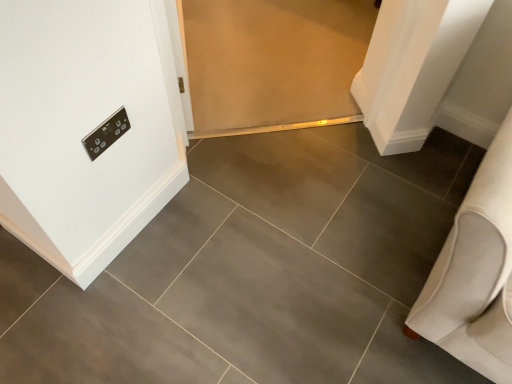
The height and width of the screenshot is (384, 512). What do you see at coordinates (475, 272) in the screenshot?
I see `white fabric sofa at right` at bounding box center [475, 272].

I want to click on white fabric sofa at right, so click(x=475, y=272).

Where is `satin silver switch at upper left`? satin silver switch at upper left is located at coordinates (106, 133).

The height and width of the screenshot is (384, 512). What do you see at coordinates (106, 133) in the screenshot? I see `satin silver switch at upper left` at bounding box center [106, 133].

Locate an element on the screen. The image size is (512, 384). white fabric sofa at right is located at coordinates (475, 272).

Visually, is satin silver switch at upper left positioned to the left or to the right of white fabric sofa at right?

In the image, satin silver switch at upper left appears on the left side of white fabric sofa at right.

Which object is closer to the camera taking this photo, satin silver switch at upper left or white fabric sofa at right?

white fabric sofa at right is more forward.

Is point (123, 112) positioned before point (490, 280)?

No, (123, 112) is behind (490, 280).

Based on the photo, from the image's perspective, which is above, satin silver switch at upper left or white fabric sofa at right?

satin silver switch at upper left appears higher in the image.

Looking at this image, from a real-world perspective, relative to white fabric sofa at right, is satin silver switch at upper left vertically above or below?

satin silver switch at upper left is above white fabric sofa at right.

Can you confirm if satin silver switch at upper left is thinner than white fabric sofa at right?

Yes.

Does satin silver switch at upper left have a greater height compared to white fabric sofa at right?

No.

Is satin silver switch at upper left bigger than white fabric sofa at right?

No, satin silver switch at upper left is not bigger than white fabric sofa at right.

Choose the correct answer: Is satin silver switch at upper left inside white fabric sofa at right or outside it?

satin silver switch at upper left is not enclosed by white fabric sofa at right.

Is satin silver switch at upper left not close to white fabric sofa at right?

Actually, satin silver switch at upper left and white fabric sofa at right are a little close together.

Is satin silver switch at upper left facing away from white fabric sofa at right?

No, white fabric sofa at right is not at the back of satin silver switch at upper left.

From the picture: How different are the orientations of satin silver switch at upper left and white fabric sofa at right in degrees?

90.3 degrees.

At what (x,y) coordinates should I click in order to perform the action: click on furniture located on the right of satin silver switch at upper left. Please return your answer as a coordinate pair (x, y). This screenshot has width=512, height=384. Looking at the image, I should click on click(x=475, y=272).

Does white fabric sofa at right appear on the right side of satin silver switch at upper left?

Yes.

In the image, is white fabric sofa at right positioned in front of or behind satin silver switch at upper left?

Visually, white fabric sofa at right is located in front of satin silver switch at upper left.

Which is further, (464, 245) or (89, 153)?

The point (89, 153) is farther from the camera.

From the image's perspective, which one is positioned higher, white fabric sofa at right or satin silver switch at upper left?

satin silver switch at upper left is shown above in the image.

From a real-world perspective, is white fabric sofa at right positioned under satin silver switch at upper left based on gravity?

Yes, from a real-world perspective, white fabric sofa at right is below satin silver switch at upper left.

Which object is wider, white fabric sofa at right or satin silver switch at upper left?

white fabric sofa at right.

Consider the image. Considering the sizes of white fabric sofa at right and satin silver switch at upper left in the image, is white fabric sofa at right taller or shorter than satin silver switch at upper left?

Clearly, white fabric sofa at right is taller compared to satin silver switch at upper left.

Which of these two, white fabric sofa at right or satin silver switch at upper left, is bigger?

white fabric sofa at right is bigger.

Which is correct: white fabric sofa at right is inside satin silver switch at upper left, or outside of it?

white fabric sofa at right is spatially situated outside satin silver switch at upper left.

Is white fabric sofa at right placed right next to satin silver switch at upper left?

white fabric sofa at right is not next to satin silver switch at upper left, and they're not touching.

Is white fabric sofa at right turned away from satin silver switch at upper left?

That's not correct — white fabric sofa at right is not looking away from satin silver switch at upper left.

What's the angular difference between white fabric sofa at right and satin silver switch at upper left's facing directions?

The facing directions of white fabric sofa at right and satin silver switch at upper left are 90.3 degrees apart.

This screenshot has height=384, width=512. In order to click on furniture below the satin silver switch at upper left (from a real-world perspective) in this screenshot , I will do click(475, 272).

Find the location of `furniture that is in front of the satin silver switch at upper left`. furniture that is in front of the satin silver switch at upper left is located at coordinates (475, 272).

Find the location of a particular element. light switch that is behind the white fabric sofa at right is located at coordinates (106, 133).